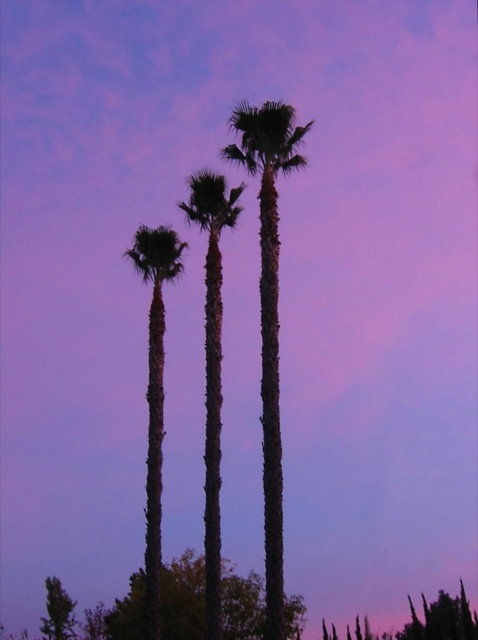
You are standing in front of the palm trees in the image. There is a point at coordinates point (269,312) that marks a specific location. Which object does this point correspond to?

The point (269,312) corresponds to the green textured palm tree at center.

You are standing in front of the three palm trees in the image. There is a point marked at coordinates (269, 312). Which palm tree does this point correspond to?

The point at coordinates (269, 312) marks the green textured palm tree at center.

You are standing in front of the scene and want to know which tree is taller between the green textured palm tree at center and the green leafy tree at lower center. Can you determine this based on the description?

The green textured palm tree at center is taller than the green leafy tree at lower center according to the description.